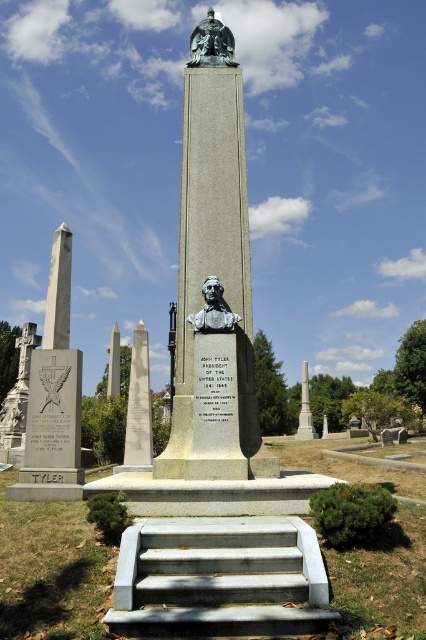
Question: Which object appears farthest from the camera in this image?

Choices:
 (A) gray concrete stairs at center
 (B) bronze statue at center
 (C) bronze statue at upper center
 (D) bronze bust at center

Answer: (C)

Question: Which of the following is the closest to the observer?

Choices:
 (A) bronze statue at upper center
 (B) bronze bust at center

Answer: (B)

Question: Can you confirm if bronze statue at upper center is positioned to the right of bronze bust at center?

Choices:
 (A) yes
 (B) no

Answer: (B)

Question: Based on their relative distances, which object is farther from the bronze statue at upper center?

Choices:
 (A) gray concrete stairs at center
 (B) bronze bust at center

Answer: (A)

Question: Can you confirm if gray concrete stairs at center is positioned above bronze statue at upper center?

Choices:
 (A) yes
 (B) no

Answer: (B)

Question: Considering the relative positions of bronze statue at center and bronze statue at upper center in the image provided, where is bronze statue at center located with respect to bronze statue at upper center?

Choices:
 (A) left
 (B) right

Answer: (A)